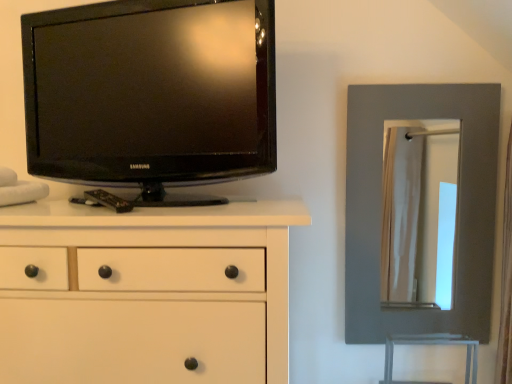
Question: Is point (374, 302) positioned closer to the camera than point (203, 208)?

Choices:
 (A) closer
 (B) farther

Answer: (B)

Question: Considering the positions of matte gray mirror at right and white matte chest of drawers at left in the image, is matte gray mirror at right wider or thinner than white matte chest of drawers at left?

Choices:
 (A) thin
 (B) wide

Answer: (A)

Question: Based on their relative distances, which object is nearer to the white matte chest of drawers at left?

Choices:
 (A) matte gray mirror at right
 (B) black glossy tv at upper left

Answer: (B)

Question: Estimate the real-world distances between objects in this image. Which object is closer to the matte gray mirror at right?

Choices:
 (A) black glossy tv at upper left
 (B) white matte chest of drawers at left

Answer: (A)